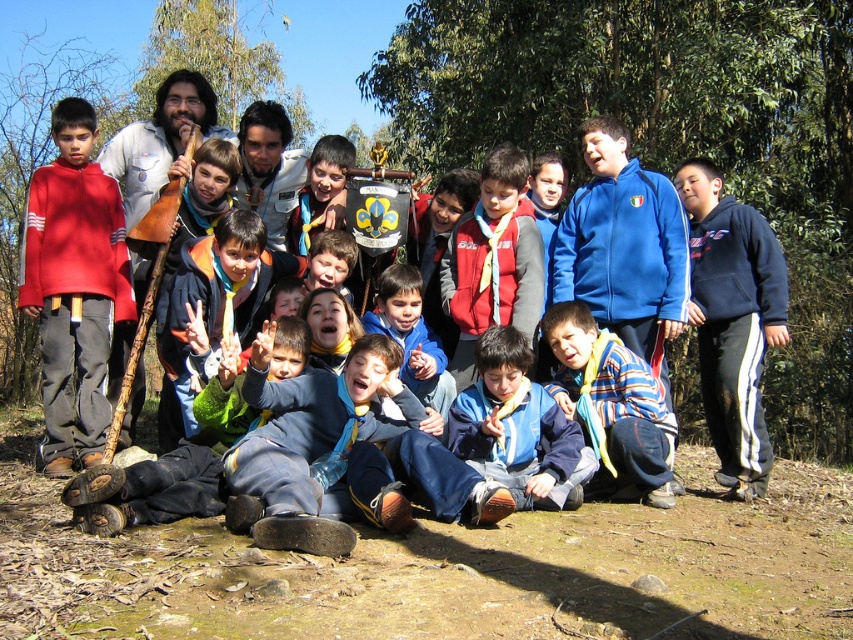
Question: Can you confirm if matte red hoodie at left is bigger than striped knitwear at center?

Choices:
 (A) yes
 (B) no

Answer: (B)

Question: Which point is farther from the camera taking this photo?

Choices:
 (A) (415, 371)
 (B) (283, 515)
 (C) (86, 342)
 (D) (502, 352)

Answer: (C)

Question: Considering the real-world distances, which object is closest to the blue fabric scarf at center?

Choices:
 (A) red fleece vest at center
 (B) blue fleece jacket at center
 (C) striped knitwear at center

Answer: (C)

Question: Which point is closer to the camera?

Choices:
 (A) (486, 317)
 (B) (137, 141)

Answer: (A)

Question: Does matte red sweater at left appear under blue fabric shirt at center?

Choices:
 (A) yes
 (B) no

Answer: (B)

Question: Can you confirm if navy blue hoodie at right is positioned to the right of striped knitwear at center?

Choices:
 (A) no
 (B) yes

Answer: (B)